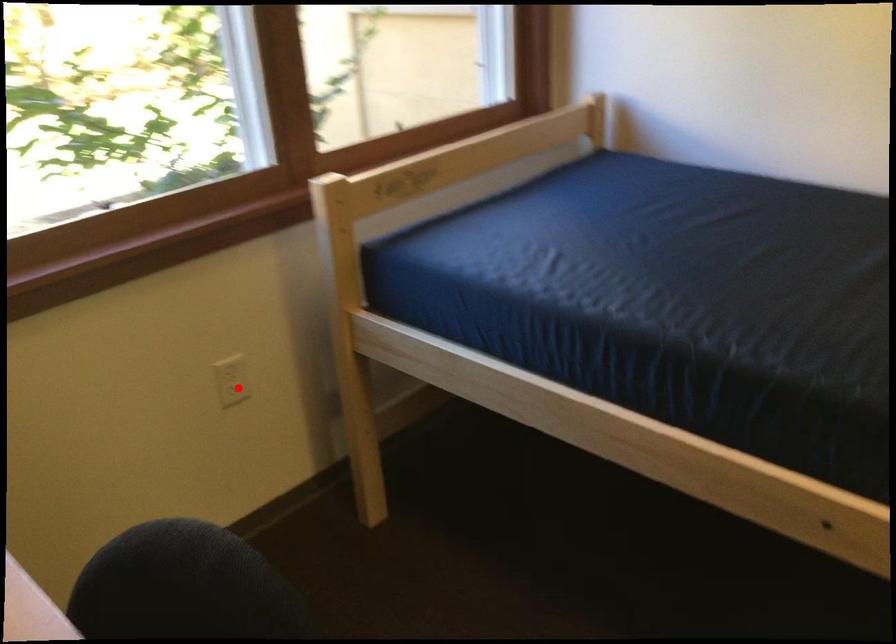
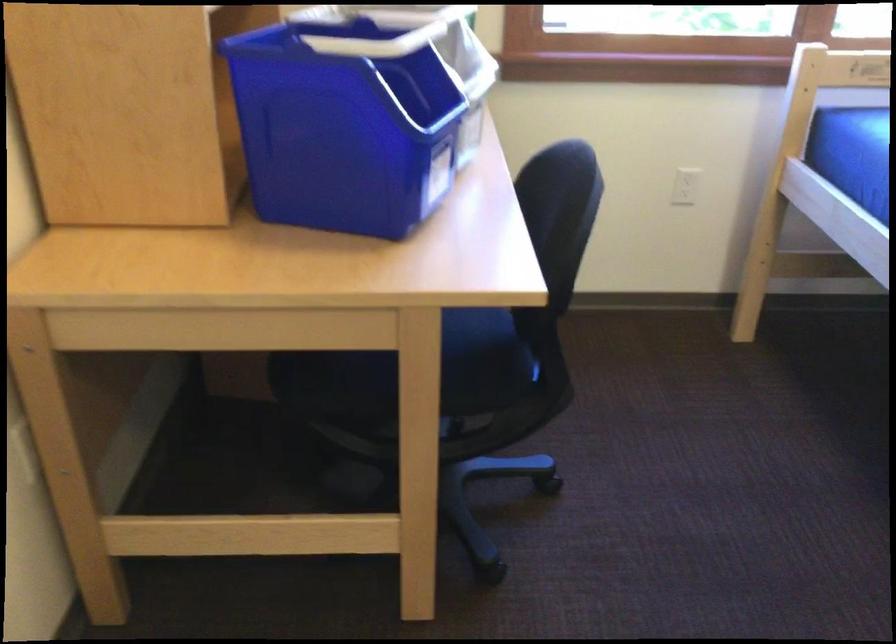
Where in the second image is the point corresponding to the highlighted location from the first image?

(683, 187)